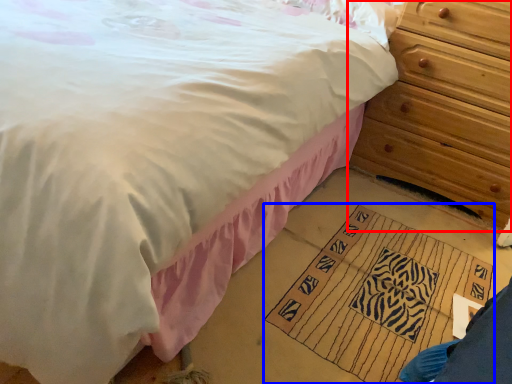
Question: Which point is further to the camera, chest of drawers (highlighted by a red box) or doormat (highlighted by a blue box)?

Choices:
 (A) chest of drawers
 (B) doormat

Answer: (A)